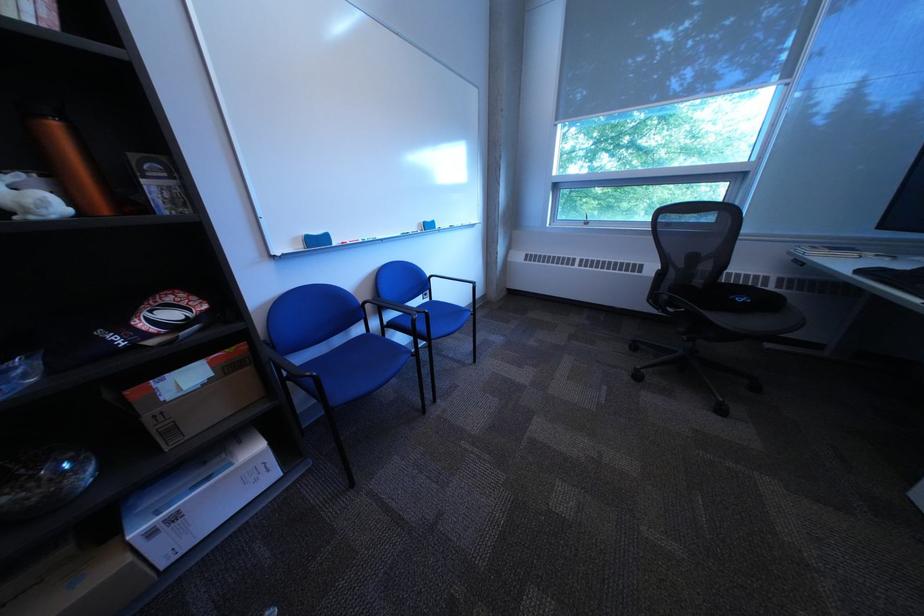
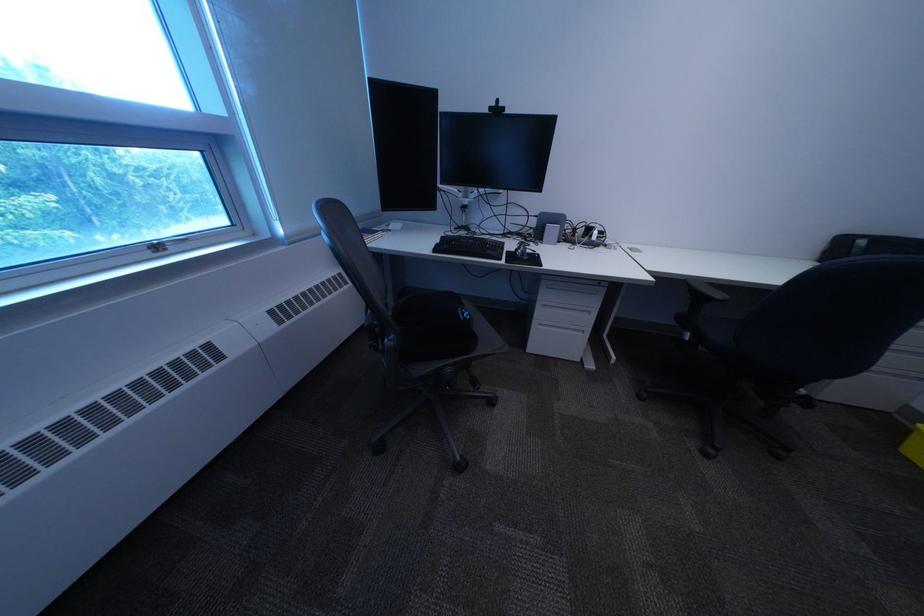
Find the pixel in the second image that matches point 877,274 in the first image.

(451, 252)